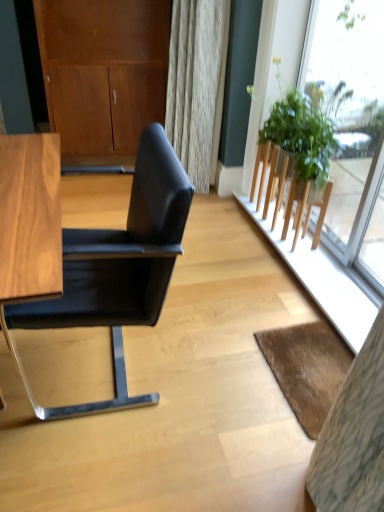
Identify the location of free space that is to the left of brown textured mat at lower right. This screenshot has height=512, width=384. (216, 381).